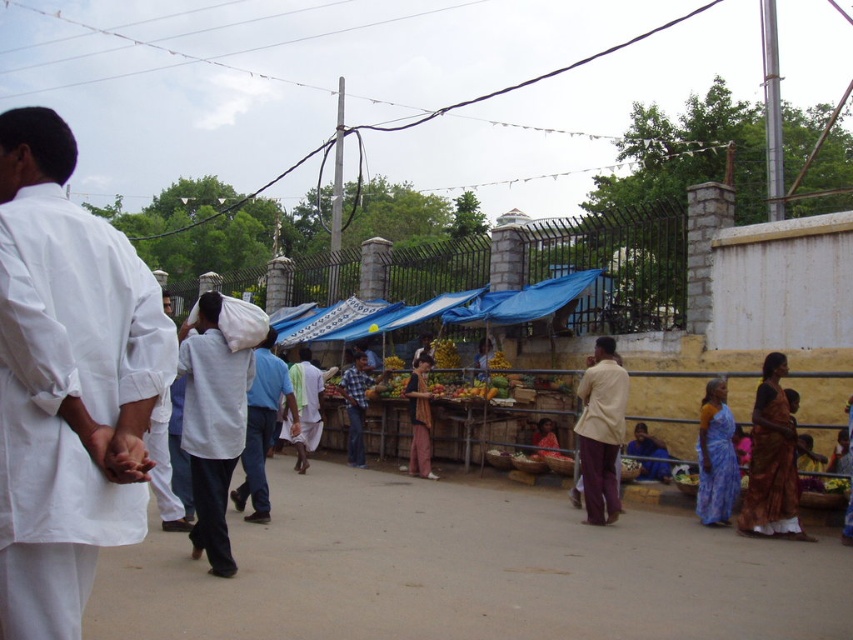
Question: Which object appears closest to the camera in this image?

Choices:
 (A) white cotton shirt at left
 (B) shiny gold saree at lower right
 (C) checkered fabric shirt at center
 (D) white cotton dhoti at center

Answer: (A)

Question: Can you confirm if white cotton shirt at left is positioned to the right of shiny gold saree at lower right?

Choices:
 (A) no
 (B) yes

Answer: (A)

Question: Can you confirm if white cotton shirt at left is thinner than checkered fabric shirt at center?

Choices:
 (A) no
 (B) yes

Answer: (B)

Question: Where is white cotton shirt at left located in relation to checkered fabric shirt at center in the image?

Choices:
 (A) left
 (B) right

Answer: (B)

Question: Which point appears farthest from the camera in this image?

Choices:
 (A) [x=704, y=464]
 (B) [x=299, y=454]
 (C) [x=355, y=438]
 (D) [x=421, y=451]

Answer: (C)

Question: Which of the following is the farthest from the observer?

Choices:
 (A) checkered fabric shirt at center
 (B) white cotton shirt at left
 (C) shiny gold saree at lower right

Answer: (A)